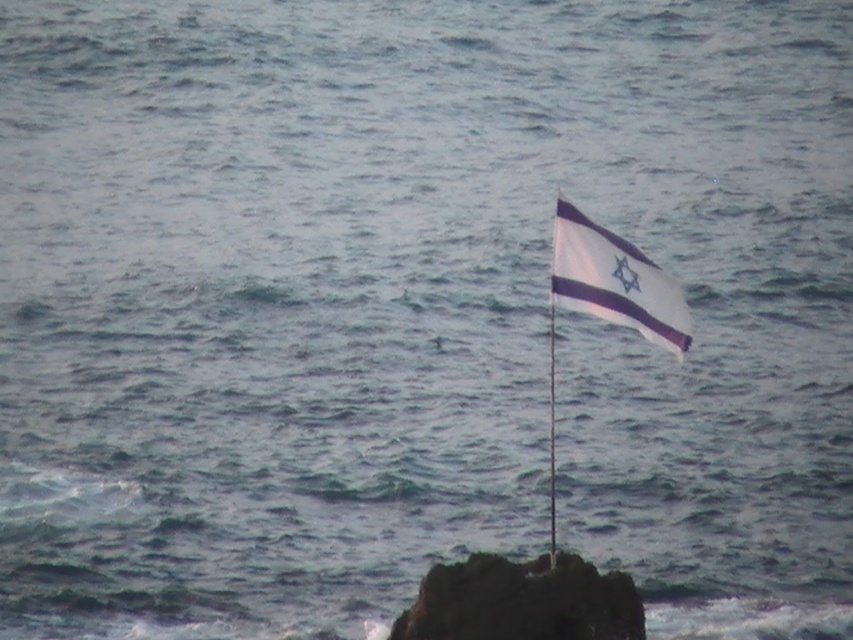
Is rough textured rock at center smaller than white fabric flag at upper right?

Answer: Actually, rough textured rock at center might be larger than white fabric flag at upper right.

Is point (520, 611) closer to camera compared to point (577, 310)?

Yes, it is.

Image resolution: width=853 pixels, height=640 pixels. Find the location of `rough textured rock at center`. rough textured rock at center is located at coordinates click(521, 602).